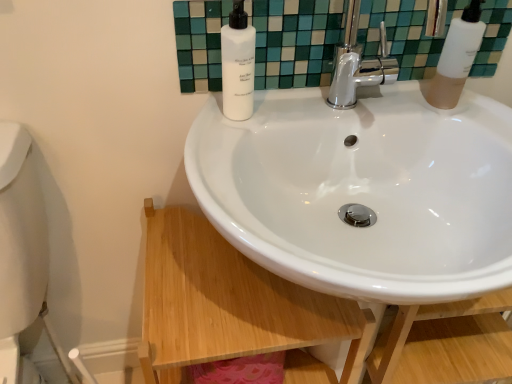
Identify the location of free location to the right of white matte bottle at upper center, which ranks as the second soap dispenser in right-to-left order. The width and height of the screenshot is (512, 384). (317, 114).